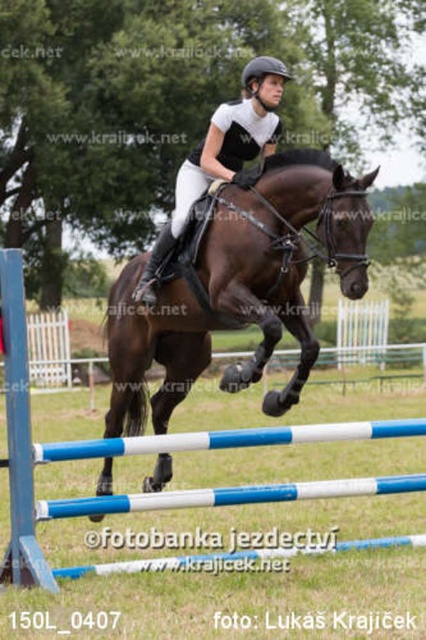
Based on the scene, where is the shiny brown horse at center located in the image?

The shiny brown horse at center is located at point 0.452 on the x axis and 0.559 on the y axis.